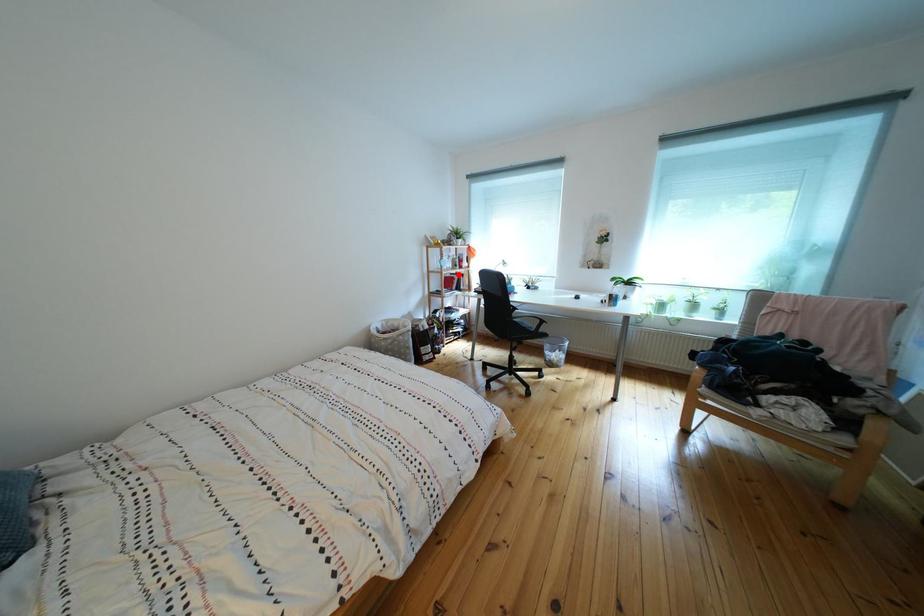
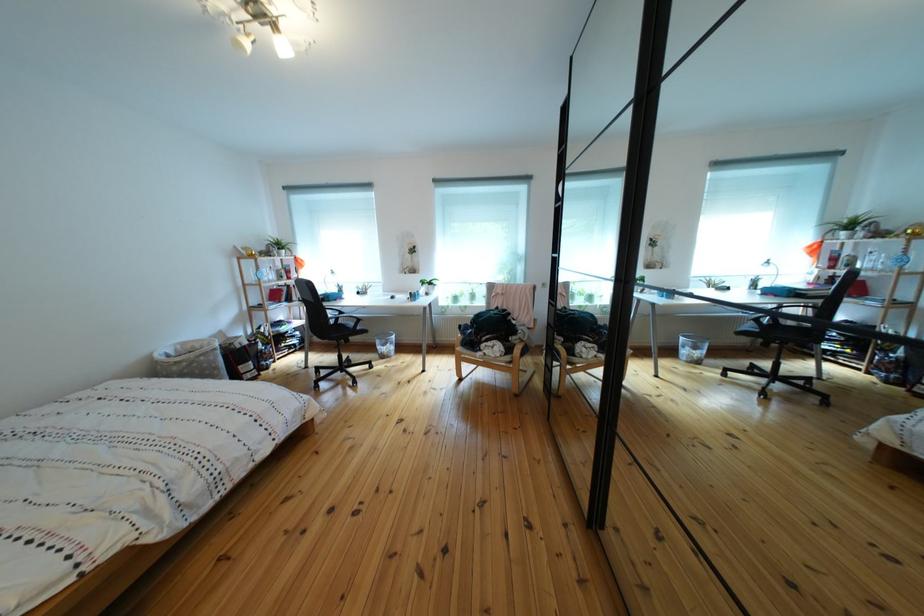
The point at the highlighted location is marked in the first image. Where is the corresponding point in the second image?

(282, 286)